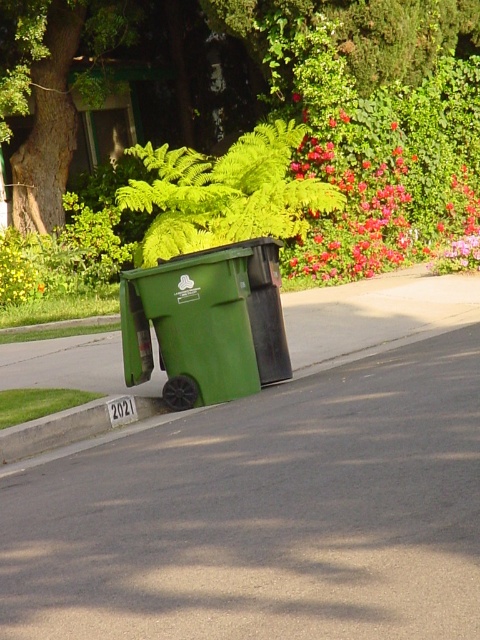
Question: Does green leafy fern at center have a larger size compared to green matte recycling bin at center?

Choices:
 (A) yes
 (B) no

Answer: (A)

Question: Is green leafy fern at center smaller than yellow matte flower at upper left?

Choices:
 (A) no
 (B) yes

Answer: (A)

Question: Among these points, which one is farthest from the camera?

Choices:
 (A) (191, 154)
 (B) (46, 220)
 (C) (222, 355)

Answer: (B)

Question: Which point is closer to the camera?

Choices:
 (A) green matte recycling bin at center
 (B) green leafy fern at center

Answer: (A)

Question: Among these points, which one is farthest from the camera?

Choices:
 (A) (7, 269)
 (B) (252, 205)
 (C) (157, 280)
 (D) (403, 36)

Answer: (A)

Question: Does green leafy tree at upper center appear over yellow matte flower at upper left?

Choices:
 (A) yes
 (B) no

Answer: (A)